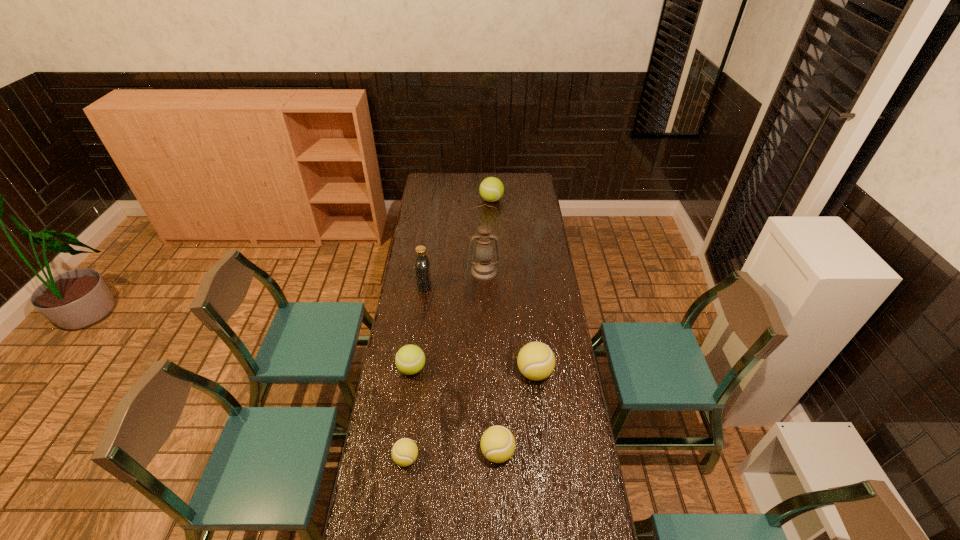
Find the location of a particular element. free point between the vodka and the rightmost tennis ball is located at coordinates (480, 329).

Where is `free area in between the left green tennis ball and the vodka`? Image resolution: width=960 pixels, height=540 pixels. free area in between the left green tennis ball and the vodka is located at coordinates (419, 327).

Where is `free space between the smaller green tennis ball and the smallest yellow tennis ball`? free space between the smaller green tennis ball and the smallest yellow tennis ball is located at coordinates (409, 414).

Identify the location of free space that is in between the tallest object and the smaller green tennis ball. Image resolution: width=960 pixels, height=540 pixels. (448, 320).

Point out which object is positioned as the third nearest to the biggest yellow tennis ball. Please provide its 2D coordinates. Your answer should be formatted as a tuple, i.e. [(x, y)], where the tuple contains the x and y coordinates of a point satisfying the conditions above.

[(405, 451)]

In order to click on the fourth closest object relative to the farthest yellow tennis ball in this screenshot , I will do pos(484,268).

The image size is (960, 540). What are the coordinates of `tennis ball that is the third closest to the farthest object` in the screenshot? It's located at (497, 443).

Locate which tennis ball is the closest to the second smallest yellow tennis ball. Please provide its 2D coordinates. Your answer should be formatted as a tuple, i.e. [(x, y)], where the tuple contains the x and y coordinates of a point satisfying the conditions above.

[(536, 361)]

Identify which yellow tennis ball is located as the nearest to the leftmost yellow tennis ball. Please provide its 2D coordinates. Your answer should be formatted as a tuple, i.e. [(x, y)], where the tuple contains the x and y coordinates of a point satisfying the conditions above.

[(497, 443)]

The height and width of the screenshot is (540, 960). I want to click on yellow tennis ball that is the second closest to the rightmost yellow tennis ball, so click(405, 451).